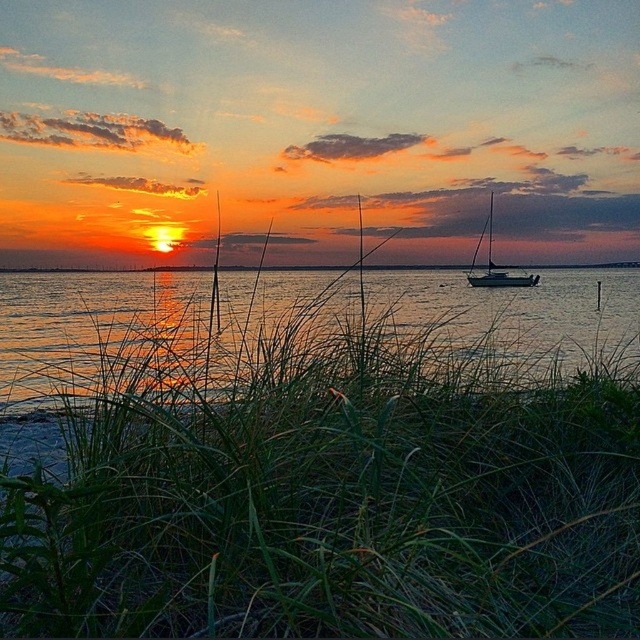
Between point (154, 490) and point (486, 268), which one is positioned behind?

The point (486, 268) is more distant.

The image size is (640, 640). Describe the element at coordinates (321, 458) in the screenshot. I see `green grass at center` at that location.

Which is in front, point (131, 454) or point (492, 193)?

Point (131, 454)

At what (x,y) coordinates should I click in order to perform the action: click on green grass at center. Please return your answer as a coordinate pair (x, y). The height and width of the screenshot is (640, 640). Looking at the image, I should click on (321, 458).

Is shiny reflective water at center bigger than satin white sailboat at right?

Indeed, shiny reflective water at center has a larger size compared to satin white sailboat at right.

Between shiny reflective water at center and satin white sailboat at right, which one appears on the left side from the viewer's perspective?

shiny reflective water at center is more to the left.

This screenshot has height=640, width=640. I want to click on shiny reflective water at center, so click(x=90, y=324).

Which is in front, point (481, 636) or point (433, 278)?

Positioned in front is point (481, 636).

This screenshot has height=640, width=640. Describe the element at coordinates (321, 458) in the screenshot. I see `green grass at center` at that location.

You are a GUI agent. You are given a task and a screenshot of the screen. Output one action in this format:
    pyautogui.click(x=<x>, y=<y>)
    Task: Click on the green grass at center
    This screenshot has height=640, width=640.
    Given the screenshot: What is the action you would take?
    pyautogui.click(x=321, y=458)